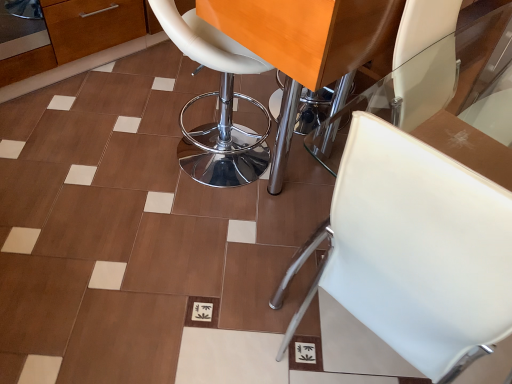
Where is `white leather stool at center, the 1th chair positioned from the left`? Image resolution: width=512 pixels, height=384 pixels. white leather stool at center, the 1th chair positioned from the left is located at coordinates (219, 102).

This screenshot has height=384, width=512. Describe the element at coordinates (219, 102) in the screenshot. I see `white leather stool at center, the second chair positioned from the right` at that location.

Measure the distance between white leather chair at center, the 1th chair positioned from the right, and camera.

white leather chair at center, the 1th chair positioned from the right, and camera are 19.44 inches apart.

Describe the element at coordinates (415, 251) in the screenshot. Image resolution: width=512 pixels, height=384 pixels. I see `white leather chair at center, positioned as the 2th chair in left-to-right order` at that location.

Where is `white leather chair at center, positioned as the 2th chair in left-to-right order`? This screenshot has width=512, height=384. white leather chair at center, positioned as the 2th chair in left-to-right order is located at coordinates (415, 251).

Looking at this image, what is the approximate width of white leather chair at center, the 1th chair positioned from the right?

white leather chair at center, the 1th chair positioned from the right, is 27.24 inches in width.

You are a GUI agent. You are given a task and a screenshot of the screen. Output one action in this format:
    pyautogui.click(x=<x>, y=<y>)
    Task: Click on the white leather stool at center, the second chair positioned from the right
    
    Given the screenshot: What is the action you would take?
    pyautogui.click(x=219, y=102)

Considering the relative positions of white leather chair at center, the 1th chair positioned from the right, and white leather stool at center, the 1th chair positioned from the left, in the image provided, is white leather chair at center, the 1th chair positioned from the right, to the left or to the right of white leather stool at center, the 1th chair positioned from the left,?

Based on their positions, white leather chair at center, the 1th chair positioned from the right, is located to the right of white leather stool at center, the 1th chair positioned from the left.

Which object is closer to the camera taking this photo, white leather chair at center, positioned as the 2th chair in left-to-right order, or white leather stool at center, the second chair positioned from the right?

white leather chair at center, positioned as the 2th chair in left-to-right order, is closer to the camera.

Which point is more forward, (377,313) or (252,57)?

Point (377,313)

From the image's perspective, between white leather chair at center, positioned as the 2th chair in left-to-right order, and white leather stool at center, the second chair positioned from the right, which one is located above?

white leather stool at center, the second chair positioned from the right, appears higher in the image.

Consider the image. From a real-world perspective, is white leather chair at center, positioned as the 2th chair in left-to-right order, physically below white leather stool at center, the 1th chair positioned from the left?

Yes, from a real-world perspective, white leather chair at center, positioned as the 2th chair in left-to-right order, is beneath white leather stool at center, the 1th chair positioned from the left.

Which object is wider, white leather chair at center, the 1th chair positioned from the right, or white leather stool at center, the second chair positioned from the right?

white leather chair at center, the 1th chair positioned from the right.

From their relative heights in the image, would you say white leather chair at center, positioned as the 2th chair in left-to-right order, is taller or shorter than white leather stool at center, the 1th chair positioned from the left?

In the image, white leather chair at center, positioned as the 2th chair in left-to-right order, appears to be shorter than white leather stool at center, the 1th chair positioned from the left.

Does white leather chair at center, positioned as the 2th chair in left-to-right order, have a larger size compared to white leather stool at center, the 1th chair positioned from the left?

Yes.

Can white leather stool at center, the second chair positioned from the right, be found inside white leather chair at center, positioned as the 2th chair in left-to-right order?

No, white leather stool at center, the second chair positioned from the right, is not surrounded by white leather chair at center, positioned as the 2th chair in left-to-right order.

Are white leather chair at center, the 1th chair positioned from the right, and white leather stool at center, the 1th chair positioned from the left, located far from each other?

Absolutely, white leather chair at center, the 1th chair positioned from the right, is distant from white leather stool at center, the 1th chair positioned from the left.

Does white leather chair at center, positioned as the 2th chair in left-to-right order, turn towards white leather stool at center, the second chair positioned from the right?

No, white leather chair at center, positioned as the 2th chair in left-to-right order, is not turned towards white leather stool at center, the second chair positioned from the right.

How many degrees apart are the facing directions of white leather chair at center, the 1th chair positioned from the right, and white leather stool at center, the second chair positioned from the right?

0.384 degrees separate the facing orientations of white leather chair at center, the 1th chair positioned from the right, and white leather stool at center, the second chair positioned from the right.

How much distance is there between white leather chair at center, the 1th chair positioned from the right, and white leather stool at center, the 1th chair positioned from the left?

white leather chair at center, the 1th chair positioned from the right, is 3.50 feet away from white leather stool at center, the 1th chair positioned from the left.

Where is `chair located behind the white leather chair at center, positioned as the 2th chair in left-to-right order`? chair located behind the white leather chair at center, positioned as the 2th chair in left-to-right order is located at coordinates (219, 102).

Is white leather stool at center, the second chair positioned from the right, at the right side of white leather chair at center, the 1th chair positioned from the right?

Incorrect, white leather stool at center, the second chair positioned from the right, is not on the right side of white leather chair at center, the 1th chair positioned from the right.

Considering the relative positions of white leather stool at center, the 1th chair positioned from the left, and white leather chair at center, the 1th chair positioned from the right, in the image provided, is white leather stool at center, the 1th chair positioned from the left, behind white leather chair at center, the 1th chair positioned from the right,?

Yes, white leather stool at center, the 1th chair positioned from the left, is further from the camera.

Is point (194, 175) closer or farther from the camera than point (361, 183)?

Clearly, point (194, 175) is more distant from the camera than point (361, 183).

From the image's perspective, is white leather stool at center, the second chair positioned from the right, below white leather chair at center, the 1th chair positioned from the right?

No.

From a real-world perspective, who is located higher, white leather stool at center, the 1th chair positioned from the left, or white leather chair at center, positioned as the 2th chair in left-to-right order?

In real-world perspective, white leather stool at center, the 1th chair positioned from the left, is above.

Can you confirm if white leather stool at center, the second chair positioned from the right, is wider than white leather chair at center, positioned as the 2th chair in left-to-right order?

In fact, white leather stool at center, the second chair positioned from the right, might be narrower than white leather chair at center, positioned as the 2th chair in left-to-right order.

From their relative heights in the image, would you say white leather stool at center, the second chair positioned from the right, is taller or shorter than white leather chair at center, the 1th chair positioned from the right?

Clearly, white leather stool at center, the second chair positioned from the right, is taller compared to white leather chair at center, the 1th chair positioned from the right.

Does white leather stool at center, the second chair positioned from the right, have a smaller size compared to white leather chair at center, the 1th chair positioned from the right?

Yes, white leather stool at center, the second chair positioned from the right, is smaller than white leather chair at center, the 1th chair positioned from the right.

Is white leather stool at center, the 1th chair positioned from the left, inside or outside of white leather chair at center, positioned as the 2th chair in left-to-right order?

white leather stool at center, the 1th chair positioned from the left, exists outside the volume of white leather chair at center, positioned as the 2th chair in left-to-right order.

Looking at this image, is the surface of white leather stool at center, the 1th chair positioned from the left, in direct contact with white leather chair at center, the 1th chair positioned from the right?

There is a gap between white leather stool at center, the 1th chair positioned from the left, and white leather chair at center, the 1th chair positioned from the right.

Is white leather stool at center, the 1th chair positioned from the left, oriented towards white leather chair at center, positioned as the 2th chair in left-to-right order?

Yes, white leather stool at center, the 1th chair positioned from the left, is facing white leather chair at center, positioned as the 2th chair in left-to-right order.

How far apart are white leather stool at center, the second chair positioned from the right, and white leather chair at center, positioned as the 2th chair in left-to-right order?

3.50 feet.

Identify the location of chair on the right of the white leather stool at center, the 1th chair positioned from the left. (415, 251).

Find the location of `chair located on the left of white leather chair at center, positioned as the 2th chair in left-to-right order`. chair located on the left of white leather chair at center, positioned as the 2th chair in left-to-right order is located at coordinates (219, 102).

The height and width of the screenshot is (384, 512). Identify the location of chair that is under the white leather stool at center, the second chair positioned from the right (from a real-world perspective). (415, 251).